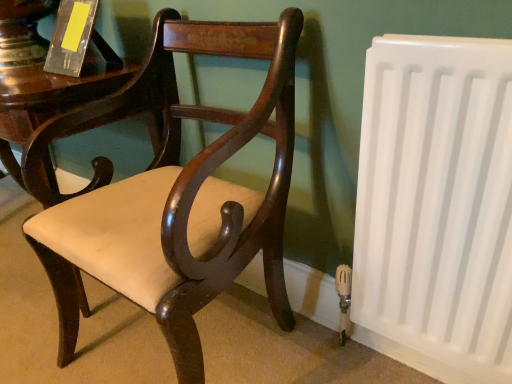
The height and width of the screenshot is (384, 512). What are the coordinates of `free region under matte wood chair at center (from a real-world perspective)` in the screenshot? It's located at tap(199, 341).